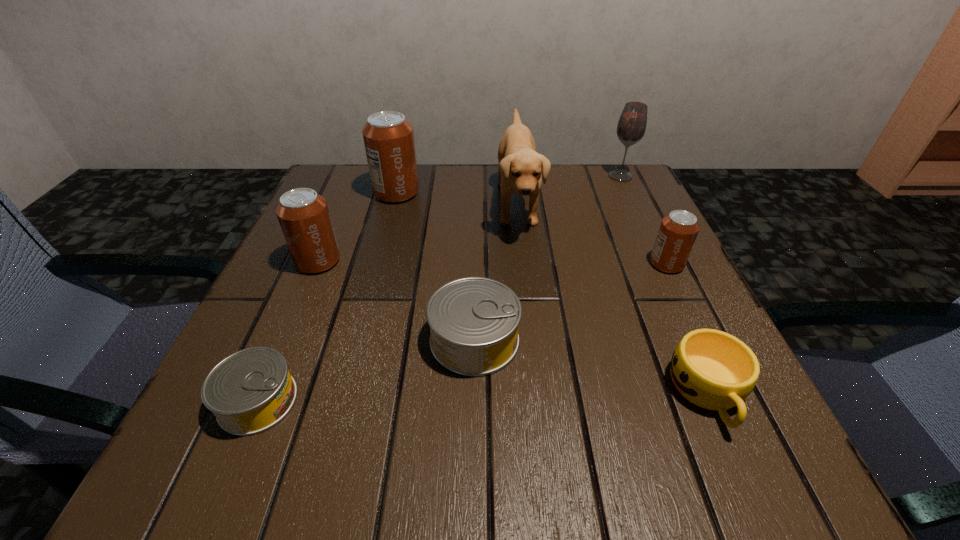
The image size is (960, 540). I want to click on beige puppy, so click(521, 168).

Identify the location of the farthest orange can. This screenshot has width=960, height=540. (388, 137).

Where is `the third can from right to left`? The width and height of the screenshot is (960, 540). the third can from right to left is located at coordinates click(x=388, y=137).

Where is `glass drink container`? The image size is (960, 540). glass drink container is located at coordinates (631, 127).

Find the location of `the fourth tallest object`. the fourth tallest object is located at coordinates (303, 215).

The height and width of the screenshot is (540, 960). What are the coordinates of `the second tallest can` in the screenshot? It's located at (303, 215).

At what (x,y) coordinates should I click in order to perform the action: click on the third shortest can. Please return your answer as a coordinate pair (x, y). This screenshot has width=960, height=540. Looking at the image, I should click on (678, 231).

Where is `the rightmost orange can`? the rightmost orange can is located at coordinates (678, 231).

You are a GUI agent. You are given a task and a screenshot of the screen. Output one action in this format:
    pyautogui.click(x=<x>, y=<y>)
    Task: Click on the bigger silver can
    Image resolution: width=960 pixels, height=540 pixels.
    Given the screenshot: What is the action you would take?
    pyautogui.click(x=474, y=321)

Identify the location of the fourth can from left to right. Image resolution: width=960 pixels, height=540 pixels. (474, 321).